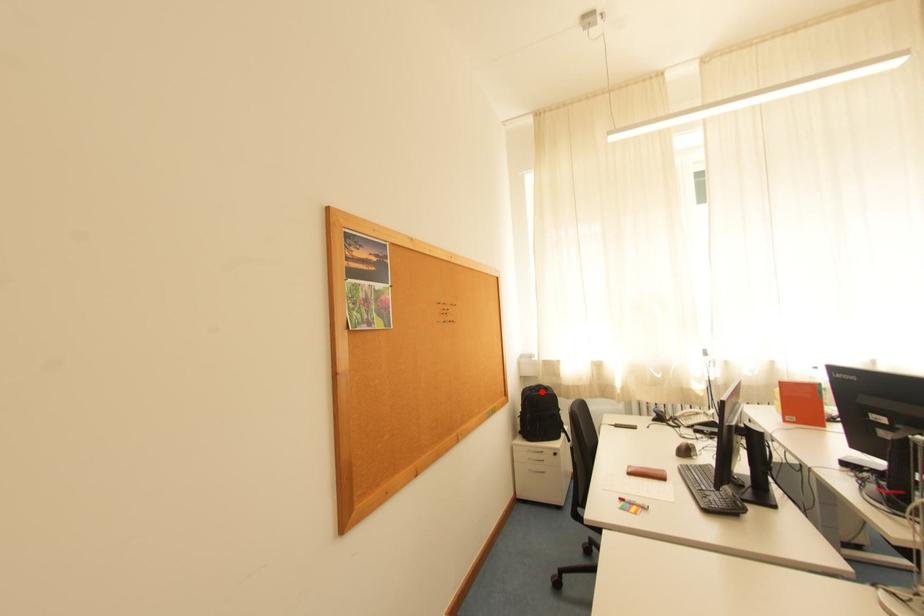
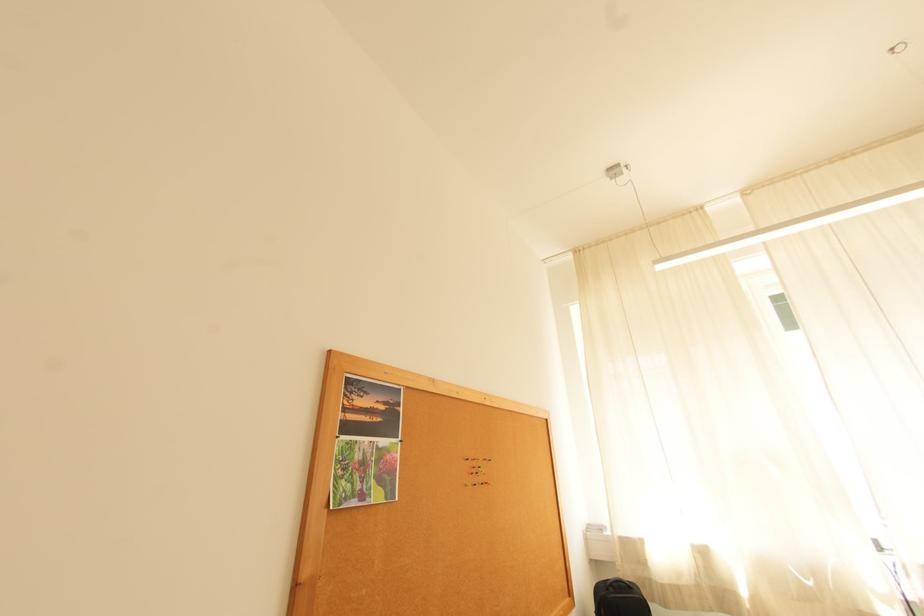
Locate, in the second image, the point that corresponds to the highlighted location in the first image.

(619, 591)